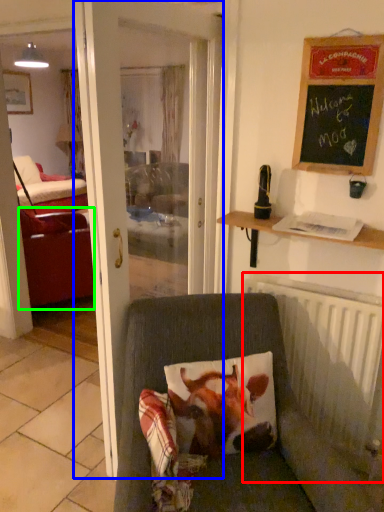
Question: Considering the real-world distances, which object is farthest from radiator (highlighted by a red box)? door (highlighted by a blue box) or studio couch (highlighted by a green box)?

Choices:
 (A) door
 (B) studio couch

Answer: (B)